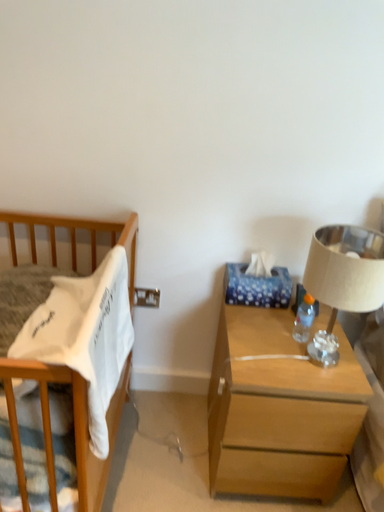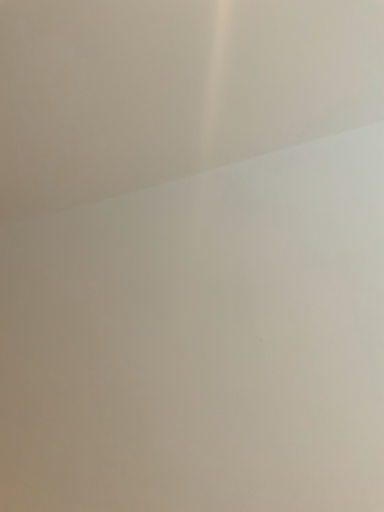
Question: Which way did the camera rotate in the video?

Choices:
 (A) rotated right
 (B) rotated left

Answer: (B)